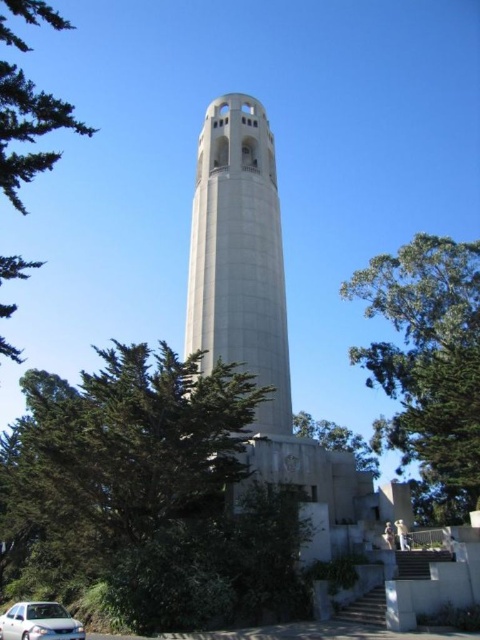
Which is more to the left, green leafy tree at upper right or green leafy tree at left?

green leafy tree at left is more to the left.

Is green leafy tree at upper right below green leafy tree at left?

Yes, green leafy tree at upper right is below green leafy tree at left.

Find the location of a particular element. green leafy tree at upper right is located at coordinates (428, 365).

Find the location of a particular element. The width and height of the screenshot is (480, 640). green leafy tree at upper right is located at coordinates (428, 365).

Is green leafy tree at center positioned in front of white concrete tower at center?

Yes, green leafy tree at center is in front of white concrete tower at center.

Does green leafy tree at center appear over white concrete tower at center?

Actually, green leafy tree at center is below white concrete tower at center.

Image resolution: width=480 pixels, height=640 pixels. Find the location of `green leafy tree at center`. green leafy tree at center is located at coordinates (151, 492).

The height and width of the screenshot is (640, 480). I want to click on green leafy tree at center, so click(x=151, y=492).

Can you confirm if green leafy tree at center is positioned below white matte car at lower left?

Incorrect, green leafy tree at center is not positioned below white matte car at lower left.

Measure the distance from green leafy tree at center to white matte car at lower left.

7.98 meters

Does point (158, 577) lie behind point (22, 605)?

No, (158, 577) is closer to viewer.

Where is `green leafy tree at center`? The image size is (480, 640). green leafy tree at center is located at coordinates (151, 492).